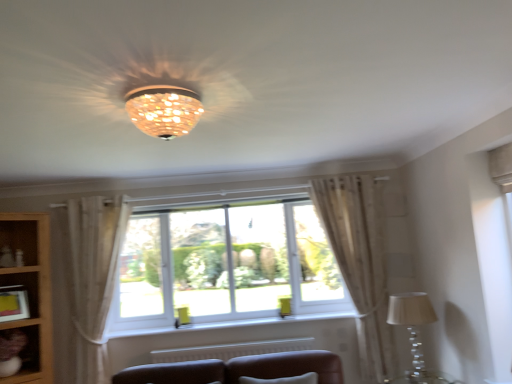
Question: Does sheer beige curtain at right, which is counted as the 2th curtain, starting from the left, have a larger size compared to white plastic window at center?

Choices:
 (A) no
 (B) yes

Answer: (A)

Question: From the image's perspective, is sheer beige curtain at right, the first curtain viewed from the right, above white plastic window at center?

Choices:
 (A) yes
 (B) no

Answer: (B)

Question: Is sheer beige curtain at right, the first curtain viewed from the right, surrounding white plastic window at center?

Choices:
 (A) no
 (B) yes

Answer: (A)

Question: Are sheer beige curtain at right, which is counted as the 2th curtain, starting from the left, and white plastic window at center beside each other?

Choices:
 (A) yes
 (B) no

Answer: (B)

Question: From a real-world perspective, is sheer beige curtain at right, the first curtain viewed from the right, located beneath white plastic window at center?

Choices:
 (A) no
 (B) yes

Answer: (B)

Question: Choose the correct answer: Is sheer beige curtain at right, which is counted as the 2th curtain, starting from the left, inside matte brown shelf at lower left or outside it?

Choices:
 (A) outside
 (B) inside

Answer: (A)

Question: Is sheer beige curtain at right, the first curtain viewed from the right, bigger or smaller than matte brown shelf at lower left?

Choices:
 (A) small
 (B) big

Answer: (B)

Question: From the image's perspective, is sheer beige curtain at right, the first curtain viewed from the right, above or below matte brown shelf at lower left?

Choices:
 (A) below
 (B) above

Answer: (B)

Question: Considering their positions, is sheer beige curtain at right, which is counted as the 2th curtain, starting from the left, located in front of or behind matte brown shelf at lower left?

Choices:
 (A) behind
 (B) front

Answer: (A)

Question: Choose the correct answer: Is matte yellow picture frame at lower left inside white plastic window at center or outside it?

Choices:
 (A) outside
 (B) inside

Answer: (A)

Question: Is matte yellow picture frame at lower left in front of or behind white plastic window at center in the image?

Choices:
 (A) front
 (B) behind

Answer: (A)

Question: Is point (0, 286) closer or farther from the camera than point (218, 311)?

Choices:
 (A) closer
 (B) farther

Answer: (A)

Question: Is matte yellow picture frame at lower left taller or shorter than white plastic window at center?

Choices:
 (A) short
 (B) tall

Answer: (A)

Question: Is white plastic window at center bigger or smaller than matte brown shelf at lower left?

Choices:
 (A) small
 (B) big

Answer: (B)

Question: In terms of width, does white plastic window at center look wider or thinner when compared to matte brown shelf at lower left?

Choices:
 (A) wide
 (B) thin

Answer: (B)